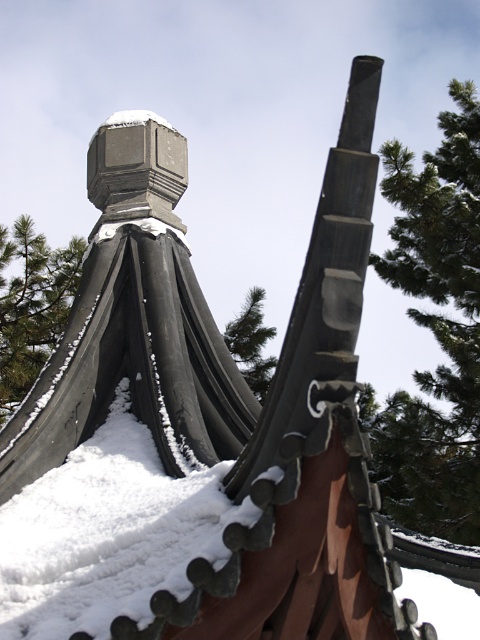
Can you confirm if green textured pine tree at upper right is smaller than green textured pine tree at upper left?

Actually, green textured pine tree at upper right might be larger than green textured pine tree at upper left.

Is point (437, 384) positioned after point (17, 228)?

That is False.

You are a GUI agent. You are given a task and a screenshot of the screen. Output one action in this format:
    pyautogui.click(x=<x>, y=<y>)
    Task: Click on the green textured pine tree at upper right
    The height and width of the screenshot is (640, 480).
    Given the screenshot: What is the action you would take?
    pyautogui.click(x=434, y=330)

Which of these two, green textured pine tree at upper right or green textured pine tree at center, stands taller?

Standing taller between the two is green textured pine tree at upper right.

Between green textured pine tree at upper right and green textured pine tree at center, which one appears on the right side from the viewer's perspective?

From the viewer's perspective, green textured pine tree at upper right appears more on the right side.

Identify the location of green textured pine tree at upper right. The width and height of the screenshot is (480, 640). [x=434, y=330].

Is green textured pine tree at upper left below green textured pine tree at center?

Correct, green textured pine tree at upper left is located below green textured pine tree at center.

Which is below, green textured pine tree at upper left or green textured pine tree at center?

green textured pine tree at upper left is lower down.

Is point (21, 368) positioned after point (241, 339)?

No, it is not.

The image size is (480, 640). I want to click on green textured pine tree at upper left, so click(32, 305).